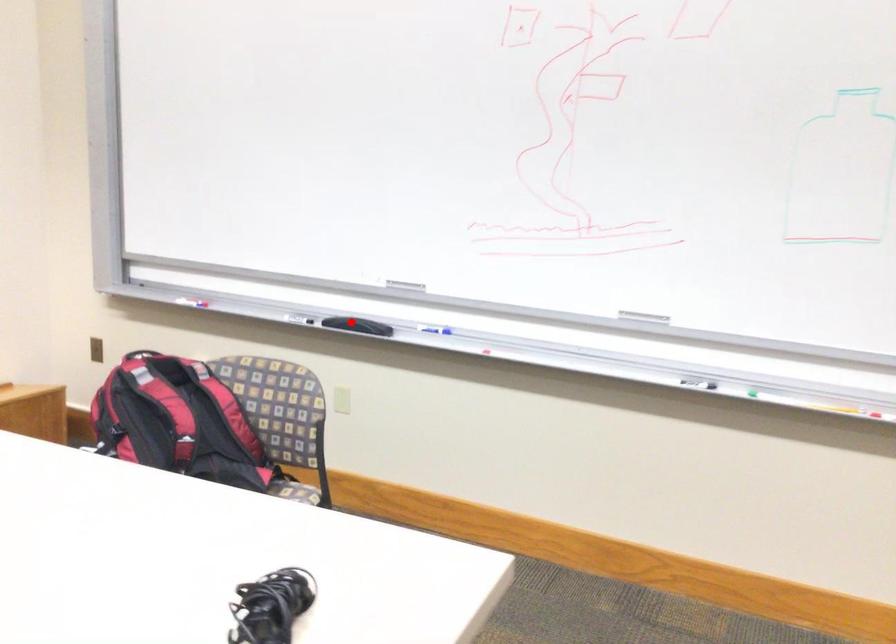
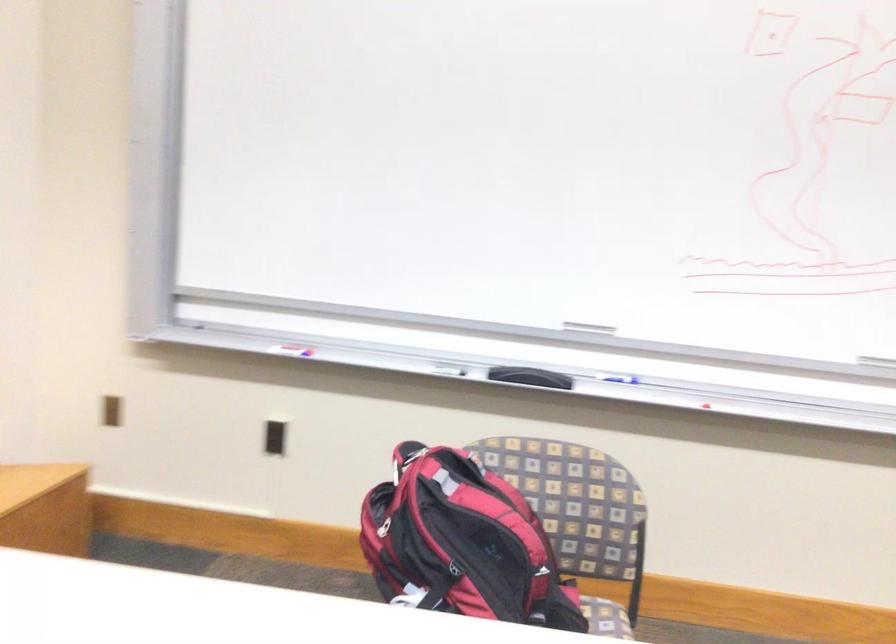
The point at the highlighted location is marked in the first image. Where is the corresponding point in the second image?

(530, 377)